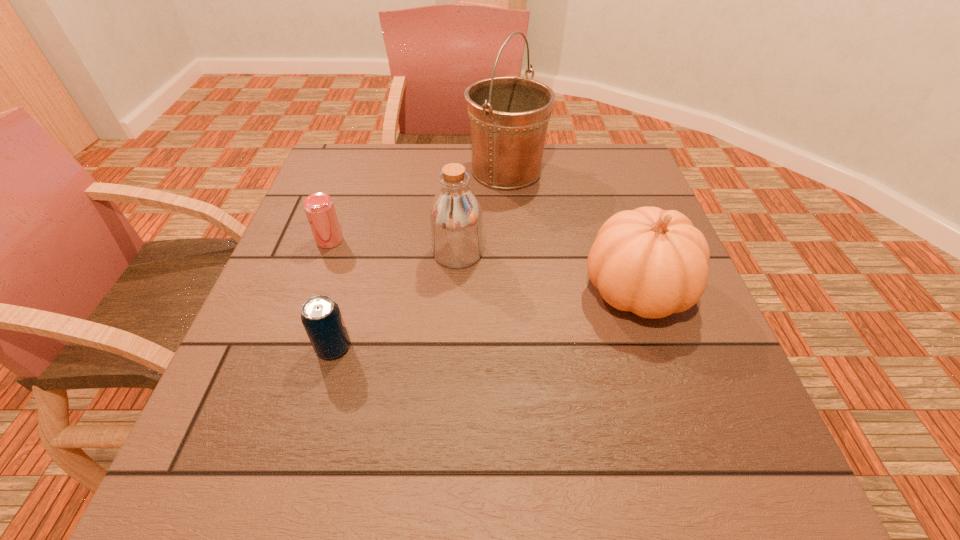
The image size is (960, 540). Identify the location of blank space located on the right of the leftmost object. (445, 240).

Locate an element on the screen. Image resolution: width=960 pixels, height=540 pixels. object located in the far edge section of the desktop is located at coordinates (509, 116).

Find the location of `soda can situated at the left edge`. soda can situated at the left edge is located at coordinates (321, 317).

The width and height of the screenshot is (960, 540). What are the coordinates of `beer can located in the left edge section of the desktop` in the screenshot? It's located at (319, 208).

The height and width of the screenshot is (540, 960). Find the location of `object that is at the right edge`. object that is at the right edge is located at coordinates [653, 262].

At what (x,y) coordinates should I click in order to perform the action: click on free space at the far edge of the desktop. Please return your answer as a coordinate pair (x, y). The image size is (960, 540). Looking at the image, I should click on (454, 148).

Image resolution: width=960 pixels, height=540 pixels. What are the coordinates of `vacant space at the near edge` in the screenshot? It's located at (644, 492).

The image size is (960, 540). What are the coordinates of `free space at the left edge of the desktop` in the screenshot? It's located at (221, 410).

In order to click on free region at the right edge of the desktop in this screenshot , I will do `click(686, 356)`.

In the image, there is a desktop. Identify the location of vacant space at the far right corner. [x=582, y=165].